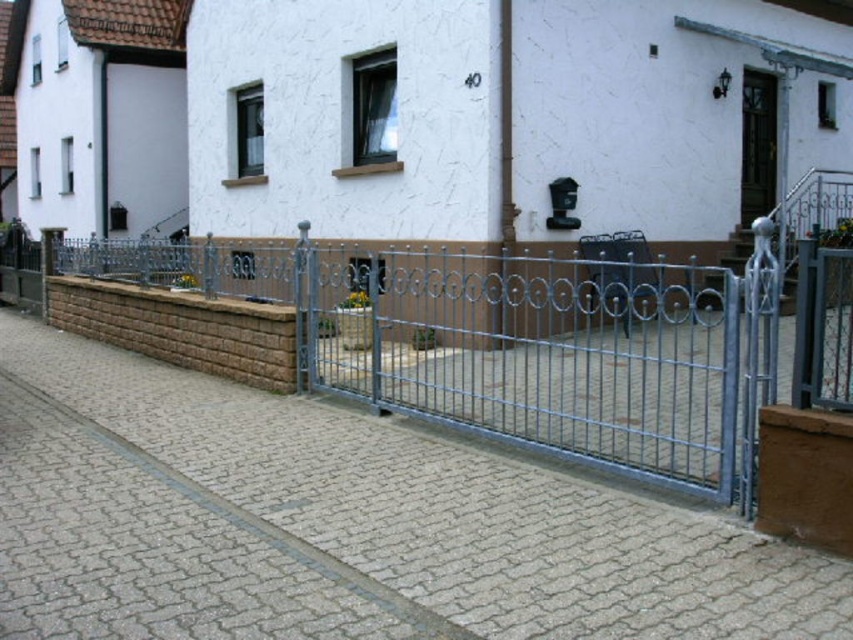
Is silver metallic gate at center to the left of brown wooden door at upper right from the viewer's perspective?

Indeed, silver metallic gate at center is positioned on the left side of brown wooden door at upper right.

Consider the image. Does silver metallic gate at center have a greater height compared to brown wooden door at upper right?

Yes.

What do you see at coordinates (514, 342) in the screenshot? I see `silver metallic gate at center` at bounding box center [514, 342].

Find the location of a particular element. silver metallic gate at center is located at coordinates (514, 342).